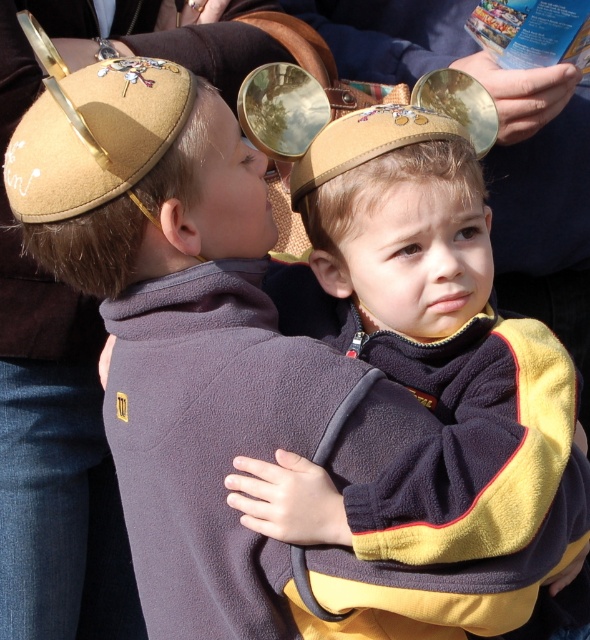
You are a photographer trying to capture a closeup of the matte brown sweater at center and the matte brown hat at center. Since both are in the same area, which one should you focus on to ensure the other remains in the background?

You should focus on the matte brown sweater at center because it is in front of the matte brown hat at center, so if you focus on the sweater, the hat will naturally be in the background.

You are a photographer adjusting your camera settings to capture a detailed shot of the matte brown sweater at center and the suede kippah at upper left. To ensure both are in focus, you need to know which object is wider. Which one has a greater width?

The matte brown sweater at center has a greater width than the suede kippah at upper left according to the description.

You are a photographer trying to capture a closeup of the matte brown sweater at center and the matte brown hat at center. Which one should you focus on first if you want to ensure both are in focus?

The matte brown sweater at center is located below the matte brown hat at center, so you should focus on the matte brown hat at center first to ensure both are in focus.